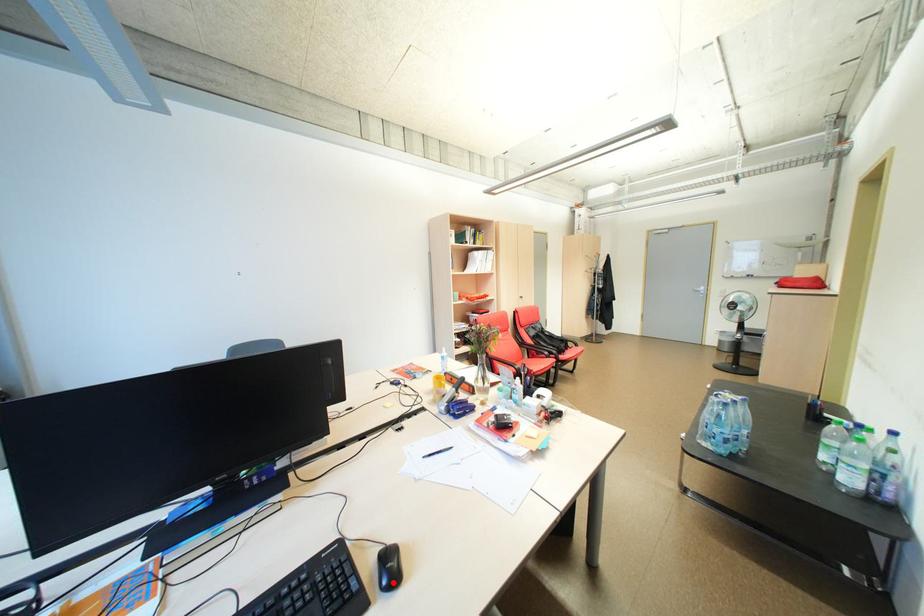
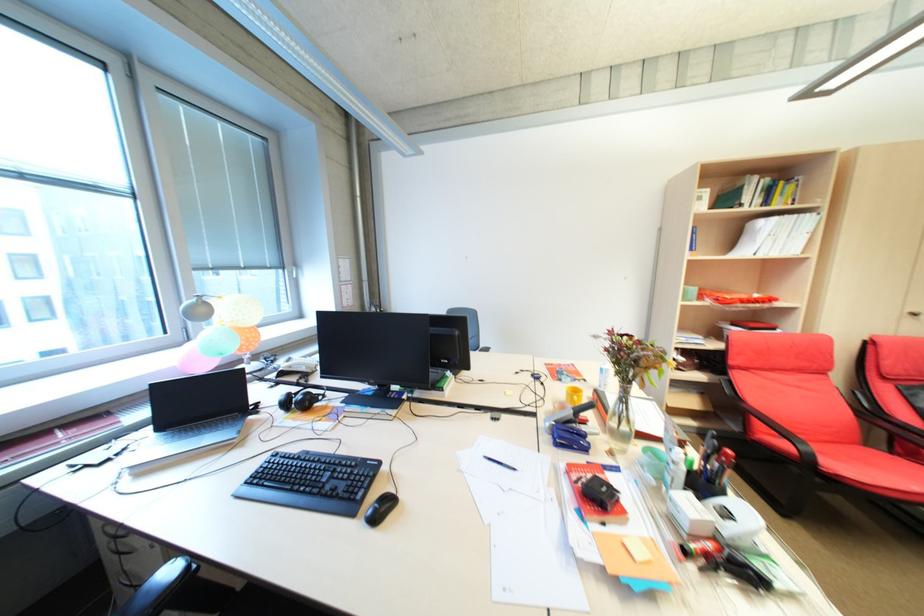
Locate, in the second image, the point that corresponds to the highlighted location in the first image.

(379, 514)